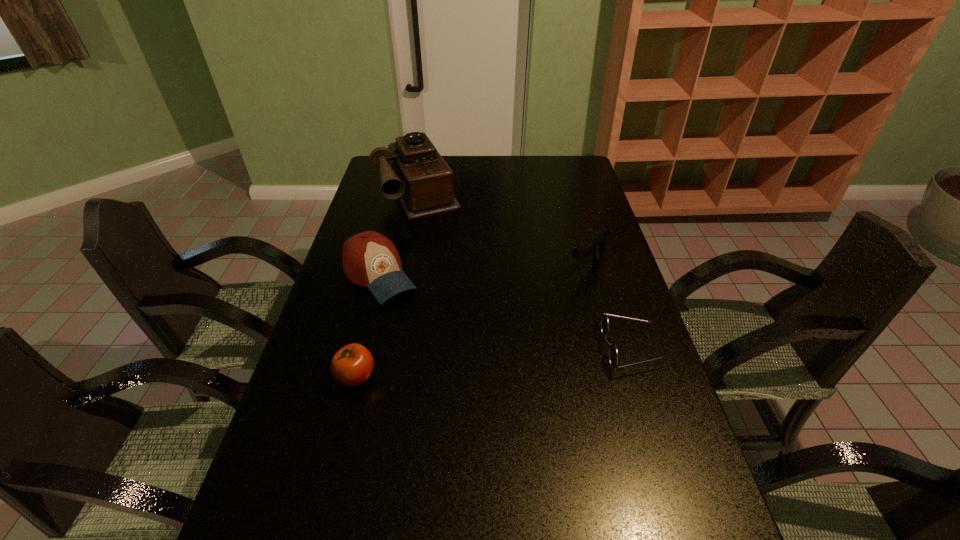
Find the location of a particular element. spectacles at the right edge is located at coordinates (x=613, y=355).

Where is `pistol situated at the right edge`? The height and width of the screenshot is (540, 960). pistol situated at the right edge is located at coordinates (594, 245).

Identify the location of object situated at the far left corner. This screenshot has height=540, width=960. (421, 179).

Find the location of a particular element. blank area at the near edge is located at coordinates (592, 503).

In the image, there is a desktop. What are the coordinates of `vacant space at the left edge` in the screenshot? It's located at (322, 427).

In order to click on vacant space at the right edge of the desktop in this screenshot , I will do `click(589, 301)`.

Image resolution: width=960 pixels, height=540 pixels. Find the location of `vacant position at the far right corner of the desktop`. vacant position at the far right corner of the desktop is located at coordinates (569, 162).

You are a GUI agent. You are given a task and a screenshot of the screen. Output one action in this format:
    pyautogui.click(x=<x>, y=<y>)
    Task: Click on the free point between the apple and the pistol
    Image resolution: width=960 pixels, height=540 pixels.
    Given the screenshot: What is the action you would take?
    pyautogui.click(x=472, y=322)

The image size is (960, 540). Identify the location of unoccupied area between the apple and the shortest object. (492, 363).

In order to click on unoccupied position between the baseball cap and the apple in this screenshot , I will do `click(368, 326)`.